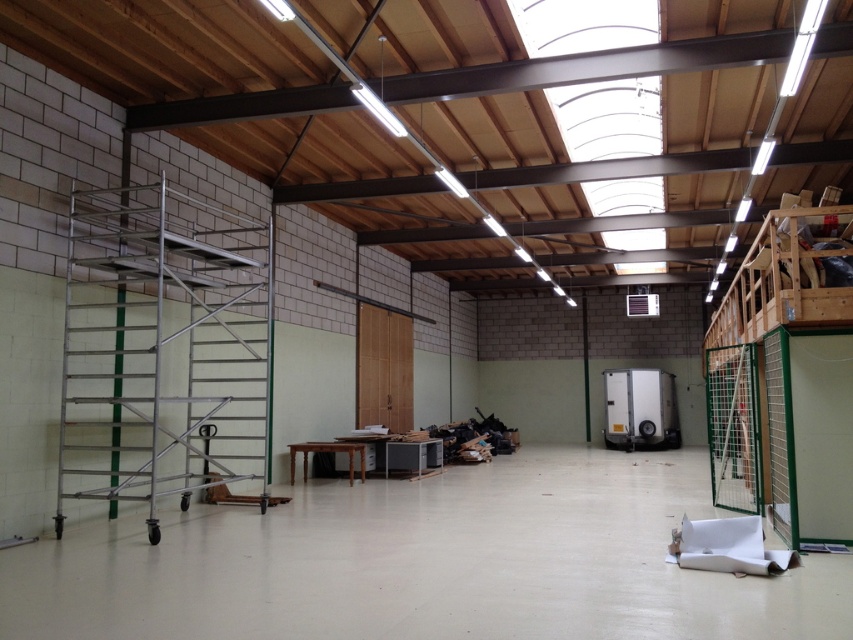
Consider the image. You are a delivery person who needs to deliver a package to the white glossy refrigerator at center. You are currently standing at the silver metallic scaffolding at left. Is the distance between you and the refrigerator sufficient to safely maneuver a handcart that requires 12 meters of clearance?

The silver metallic scaffolding at left is 13.13 meters away from the white glossy refrigerator at center. Since the required clearance is 12 meters, the distance is sufficient for the handcart to maneuver safely.

You are a contractor assessing the renovation site. You need to determine if the silver metallic scaffolding at left can be moved closer to the metallic gray printer at center without obstructing the door behind the printer. Can it be done?

The silver metallic scaffolding at left is taller than the metallic gray printer at center. Moving it closer would not obstruct the door behind the printer since the door is already behind the printer and the scaffolding height does not affect its accessibility.

You are organizing a space in a room that has a white glossy refrigerator at center and a metallic gray printer at center. Which object is located to the right of the other?

The white glossy refrigerator at center is positioned on the right side of the metallic gray printer at center, so the refrigerator is to the right of the printer.